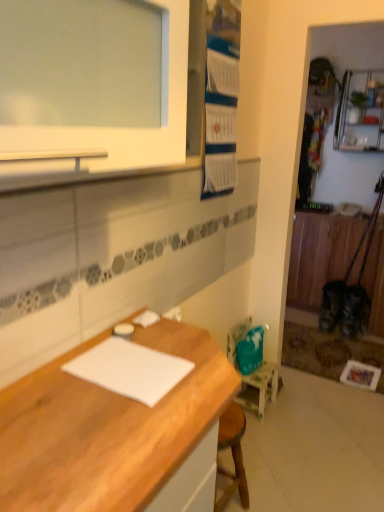
Find the location of a particular element. The image size is (384, 512). vacant space to the left of white paper at center is located at coordinates (54, 381).